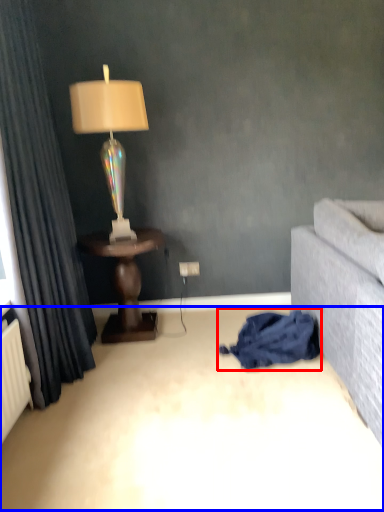
Question: Which object appears farthest to the camera in this image, blanket (highlighted by a red box) or plain (highlighted by a blue box)?

Choices:
 (A) blanket
 (B) plain

Answer: (A)